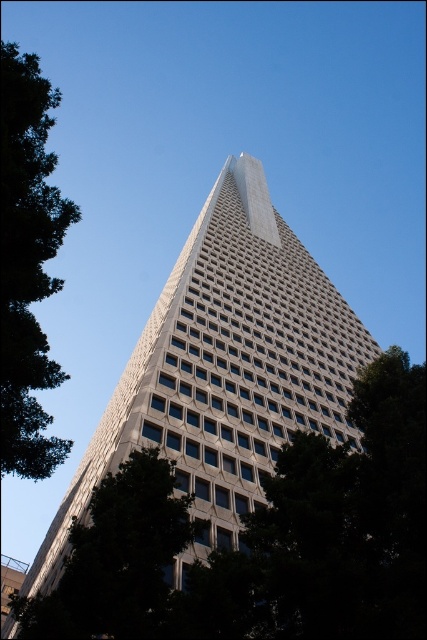
Question: Which object appears farthest from the camera in this image?

Choices:
 (A) green leafy tree at left
 (B) green leafy tree at lower left

Answer: (A)

Question: In this image, where is white glass building at center located relative to green leafy tree at lower left?

Choices:
 (A) left
 (B) right

Answer: (B)

Question: Is white glass building at center closer to camera compared to green leafy tree at left?

Choices:
 (A) yes
 (B) no

Answer: (B)

Question: Is white glass building at center positioned before green leafy tree at left?

Choices:
 (A) no
 (B) yes

Answer: (A)

Question: Which point is farther to the camera?

Choices:
 (A) pos(2,92)
 (B) pos(116,481)

Answer: (B)

Question: Which point is farther to the camera?

Choices:
 (A) green leafy tree at lower left
 (B) green leafy tree at left
 (C) white glass building at center

Answer: (C)